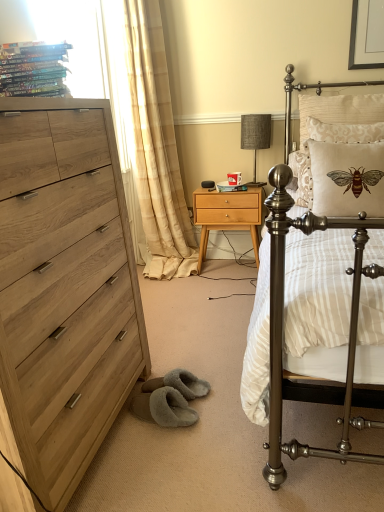
The image size is (384, 512). Find the location of `light wood/texture nightstand at center`. light wood/texture nightstand at center is located at coordinates (228, 215).

What do you see at coordinates (347, 178) in the screenshot? This screenshot has height=512, width=384. I see `beige fabric pillow with embroidered bee at upper right, the third pillow in the back-to-front sequence` at bounding box center [347, 178].

The width and height of the screenshot is (384, 512). What are the coordinates of `beige fabric pillow with embroidered bee at upper right, the first pillow from the front` in the screenshot? It's located at (347, 178).

The width and height of the screenshot is (384, 512). Identify the location of metallic bed at right. (283, 300).

The height and width of the screenshot is (512, 384). Find the location of `beige textured pillow with bee design at upper right, the 1th pillow when ordered from back to front`. beige textured pillow with bee design at upper right, the 1th pillow when ordered from back to front is located at coordinates (339, 110).

This screenshot has height=512, width=384. In order to click on matte white magazine at center, marked as the 2th magazine in a left-to-right arrangement in this screenshot , I will do `click(229, 187)`.

Where is `light wood dresser at left`? This screenshot has height=512, width=384. light wood dresser at left is located at coordinates (64, 288).

From the image's perspective, is hardcover books at upper left, positioned as the 2th magazine in right-to-left order, over beige damask pillow at upper right, placed as the 2th pillow when sorted from back to front?

Actually, hardcover books at upper left, positioned as the 2th magazine in right-to-left order, appears below beige damask pillow at upper right, placed as the 2th pillow when sorted from back to front, in the image.

Which object is further away from the camera, hardcover books at upper left, the first magazine when ordered from left to right, or beige damask pillow at upper right, placed as the 2th pillow when sorted from back to front?

beige damask pillow at upper right, placed as the 2th pillow when sorted from back to front, is behind.

Who is bigger, hardcover books at upper left, the second magazine viewed from the back, or beige damask pillow at upper right, marked as the second pillow in a front-to-back arrangement?

With larger size is beige damask pillow at upper right, marked as the second pillow in a front-to-back arrangement.

Is gray fuzzy slippers at lower center a part of metallic bed at right?

Actually, gray fuzzy slippers at lower center is outside metallic bed at right.

Is there a large distance between metallic bed at right and gray fuzzy slippers at lower center?

metallic bed at right is near gray fuzzy slippers at lower center, not far away.

Considering the sizes of metallic bed at right and gray fuzzy slippers at lower center in the image, is metallic bed at right taller or shorter than gray fuzzy slippers at lower center?

metallic bed at right is taller than gray fuzzy slippers at lower center.

Can you confirm if beige textured pillow with bee design at upper right, positioned as the 3th pillow in front-to-back order, is thinner than beige damask pillow at upper right, placed as the 2th pillow when sorted from back to front?

No.

Is beige textured pillow with bee design at upper right, the 1th pillow when ordered from back to front, bigger than beige damask pillow at upper right, marked as the second pillow in a front-to-back arrangement?

Indeed, beige textured pillow with bee design at upper right, the 1th pillow when ordered from back to front, has a larger size compared to beige damask pillow at upper right, marked as the second pillow in a front-to-back arrangement.

Looking at this image, is beige textured pillow with bee design at upper right, positioned as the 3th pillow in front-to-back order, completely or partially outside of beige damask pillow at upper right, marked as the second pillow in a front-to-back arrangement?

Yes, beige textured pillow with bee design at upper right, positioned as the 3th pillow in front-to-back order, is outside of beige damask pillow at upper right, marked as the second pillow in a front-to-back arrangement.

How different are the orientations of beige textured pillow with bee design at upper right, the 1th pillow when ordered from back to front, and beige damask pillow at upper right, marked as the second pillow in a front-to-back arrangement, in degrees?

0.0067 degrees separate the facing orientations of beige textured pillow with bee design at upper right, the 1th pillow when ordered from back to front, and beige damask pillow at upper right, marked as the second pillow in a front-to-back arrangement.

From a real-world perspective, is metallic bed at right on top of beige damask pillow at upper right, placed as the 2th pillow when sorted from back to front?

No.

Where is `pillow that is the 2nd one when counting backward from the metallic bed at right`? pillow that is the 2nd one when counting backward from the metallic bed at right is located at coordinates (344, 132).

How different are the orientations of metallic bed at right and beige damask pillow at upper right, placed as the 2th pillow when sorted from back to front, in degrees?

metallic bed at right and beige damask pillow at upper right, placed as the 2th pillow when sorted from back to front, are facing 3.63 degrees away from each other.

Based on the photo, which object is positioned more to the left, metallic bed at right or beige damask pillow at upper right, placed as the 2th pillow when sorted from back to front?

metallic bed at right.

From the image's perspective, which one is positioned higher, beige textured pillow with bee design at upper right, positioned as the 3th pillow in front-to-back order, or textured fabric lampshade at upper center?

textured fabric lampshade at upper center, from the image's perspective.

Is beige textured pillow with bee design at upper right, the 1th pillow when ordered from back to front, in front of textured fabric lampshade at upper center?

Yes, it is in front of textured fabric lampshade at upper center.

Is beige textured pillow with bee design at upper right, positioned as the 3th pillow in front-to-back order, bigger than textured fabric lampshade at upper center?

Yes, beige textured pillow with bee design at upper right, positioned as the 3th pillow in front-to-back order, is bigger than textured fabric lampshade at upper center.

Considering the sizes of objects beige textured pillow with bee design at upper right, positioned as the 3th pillow in front-to-back order, and textured fabric lampshade at upper center in the image provided, who is wider, beige textured pillow with bee design at upper right, positioned as the 3th pillow in front-to-back order, or textured fabric lampshade at upper center?

beige textured pillow with bee design at upper right, positioned as the 3th pillow in front-to-back order.

Is light wood dresser at left positioned before beige damask pillow at upper right, placed as the 2th pillow when sorted from back to front?

Yes, light wood dresser at left is closer to the viewer.

Does light wood dresser at left have a smaller size compared to beige damask pillow at upper right, placed as the 2th pillow when sorted from back to front?

Actually, light wood dresser at left might be larger than beige damask pillow at upper right, placed as the 2th pillow when sorted from back to front.

Are light wood dresser at left and beige damask pillow at upper right, placed as the 2th pillow when sorted from back to front, located far from each other?

Indeed, light wood dresser at left is not near beige damask pillow at upper right, placed as the 2th pillow when sorted from back to front.

Which is more distant, (346, 412) or (269, 140)?

The point (269, 140) is behind.

Visually, is metallic bed at right positioned to the left or to the right of textured fabric lampshade at upper center?

In the image, metallic bed at right appears on the right side of textured fabric lampshade at upper center.

Is metallic bed at right taller than textured fabric lampshade at upper center?

Correct, metallic bed at right is much taller as textured fabric lampshade at upper center.

Does metallic bed at right touch textured fabric lampshade at upper center?

They are not placed beside each other.

Identify the location of the 1st pillow above the hardcover books at upper left, the first magazine when ordered from left to right (from the image's perspective). (344, 132).

What are the coordinates of `gray that appears on the left of metallic bed at right` in the screenshot? It's located at (169, 399).

From the image, which object appears to be farther from matte white magazine at center, the second magazine when ordered from front to back, beige sheer curtain at left or beige fabric pillow with embroidered bee at upper right, the third pillow in the back-to-front sequence?

beige fabric pillow with embroidered bee at upper right, the third pillow in the back-to-front sequence, is further to matte white magazine at center, the second magazine when ordered from front to back.

Based on their spatial positions, is beige sheer curtain at left or matte white magazine at center, the second magazine when ordered from front to back, closer to beige damask pillow at upper right, placed as the 2th pillow when sorted from back to front?

matte white magazine at center, the second magazine when ordered from front to back.

From the image, which object appears to be farther from textured fabric lampshade at upper center, gray fuzzy slippers at lower center or hardcover books at upper left, the first magazine when ordered from left to right?

gray fuzzy slippers at lower center lies further to textured fabric lampshade at upper center than the other object.

Estimate the real-world distances between objects in this image. Which object is closer to light wood dresser at left, beige textured pillow with bee design at upper right, positioned as the 3th pillow in front-to-back order, or beige fabric pillow with embroidered bee at upper right, the third pillow in the back-to-front sequence?

Based on the image, beige fabric pillow with embroidered bee at upper right, the third pillow in the back-to-front sequence, appears to be nearer to light wood dresser at left.

Estimate the real-world distances between objects in this image. Which object is further from metallic bed at right, light wood/texture nightstand at center or light wood dresser at left?

light wood/texture nightstand at center lies further to metallic bed at right than the other object.

Based on their spatial positions, is beige sheer curtain at left or hardcover books at upper left, the second magazine viewed from the back, closer to beige damask pillow at upper right, marked as the second pillow in a front-to-back arrangement?

The object closer to beige damask pillow at upper right, marked as the second pillow in a front-to-back arrangement, is beige sheer curtain at left.

Based on their spatial positions, is beige sheer curtain at left or gray fuzzy slippers at lower center further from beige fabric pillow with embroidered bee at upper right, the third pillow in the back-to-front sequence?

The object further to beige fabric pillow with embroidered bee at upper right, the third pillow in the back-to-front sequence, is beige sheer curtain at left.

Estimate the real-world distances between objects in this image. Which object is closer to metallic bed at right, gray fuzzy slippers at lower center or textured fabric lampshade at upper center?

The object closer to metallic bed at right is gray fuzzy slippers at lower center.

Where is `nightstand between metallic bed at right and matte white magazine at center, which is the 1th magazine in right-to-left order, from front to back`? nightstand between metallic bed at right and matte white magazine at center, which is the 1th magazine in right-to-left order, from front to back is located at coordinates (228, 215).

You are a GUI agent. You are given a task and a screenshot of the screen. Output one action in this format:
    pyautogui.click(x=<x>, y=<y>)
    Task: Click on the gray between hardcover books at upper left, acting as the first magazine starting from the front, and light wood/texture nightstand at center from front to back
    
    Given the screenshot: What is the action you would take?
    pyautogui.click(x=169, y=399)

At what (x,y) coordinates should I click in order to perform the action: click on magazine between light wood/texture nightstand at center and beige textured pillow with bee design at upper right, the 1th pillow when ordered from back to front, from left to right. Please return your answer as a coordinate pair (x, y). Looking at the image, I should click on (229, 187).

Locate an element on the screen. This screenshot has width=384, height=512. table lamp between beige sheer curtain at left and gray fuzzy slippers at lower center in the up-down direction is located at coordinates (255, 133).